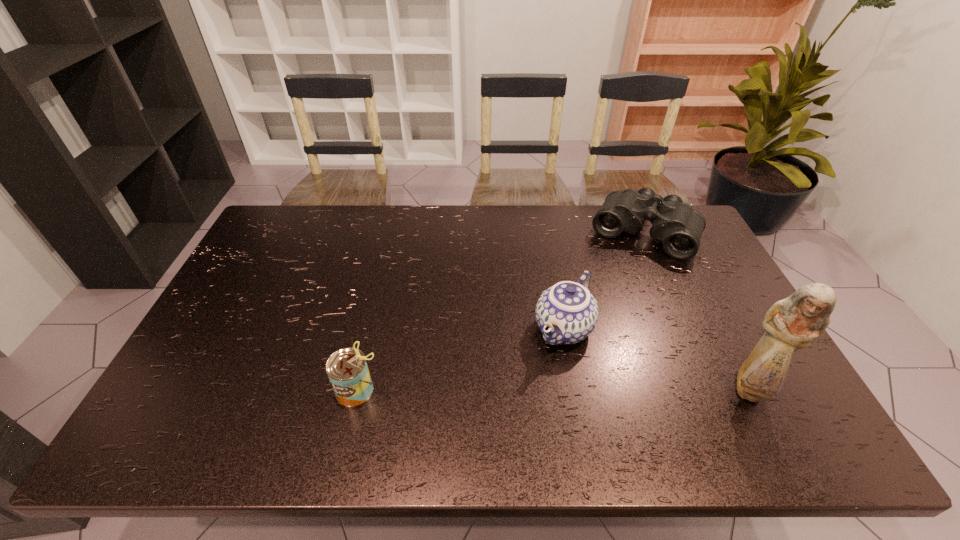
You are a GUI agent. You are given a task and a screenshot of the screen. Output one action in this format:
    pyautogui.click(x=<x>, y=<y>)
    Task: Click on the leftmost object
    The width and height of the screenshot is (960, 540).
    Given the screenshot: What is the action you would take?
    point(347,369)

Find the location of a particular element. The width and height of the screenshot is (960, 540). figurine is located at coordinates (793, 323).

Where is `the farthest object`? the farthest object is located at coordinates (674, 223).

Find the location of a particular element. The height and width of the screenshot is (540, 960). the shortest object is located at coordinates (674, 223).

At what (x,y) coordinates should I click in order to perform the action: click on the second farthest object. Please return your answer as a coordinate pair (x, y). Looking at the image, I should click on (566, 313).

Locate an element on the screen. chinaware is located at coordinates (566, 313).

The width and height of the screenshot is (960, 540). In order to click on vacant space located 0.350m on the back of the leftmost object in this screenshot , I will do `click(384, 275)`.

At what (x,y) coordinates should I click in order to perform the action: click on vacant space located at the eyepieces of the shortest object. Please return your answer as a coordinate pair (x, y). The image size is (960, 540). Looking at the image, I should click on (601, 316).

Identify the location of vacant space situated 0.360m at the eyepieces of the shortest object. (591, 335).

I want to click on vacant region located 0.120m at the eyepieces of the shortest object, so click(617, 282).